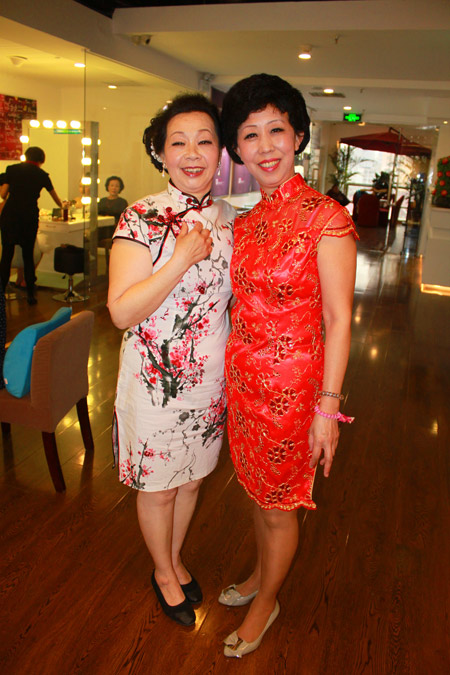
The height and width of the screenshot is (675, 450). I want to click on lights, so click(x=85, y=198), click(x=87, y=161), click(x=81, y=177), click(x=85, y=135), click(x=71, y=124), click(x=56, y=117), click(x=42, y=124), click(x=33, y=121), click(x=22, y=135).